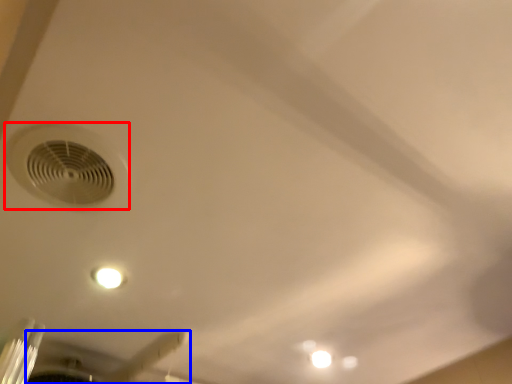
Question: Which object is closer to the camera taking this photo, air conditioning (highlighted by a red box) or ceiling fan (highlighted by a blue box)?

Choices:
 (A) air conditioning
 (B) ceiling fan

Answer: (A)